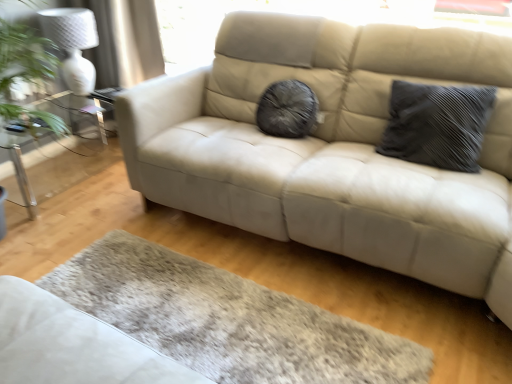
Question: Is dark gray textured pillow at right wider or thinner than clear glass table at left?

Choices:
 (A) wide
 (B) thin

Answer: (B)

Question: From a real-world perspective, relative to clear glass table at left, is dark gray textured pillow at right vertically above or below?

Choices:
 (A) above
 (B) below

Answer: (A)

Question: Which object is the closest to the clear glass table at left?

Choices:
 (A) white textured lamp at upper left
 (B) dark gray textured pillow at right

Answer: (A)

Question: Estimate the real-world distances between objects in this image. Which object is farther from the dark gray textured pillow at right?

Choices:
 (A) clear glass table at left
 (B) white textured lamp at upper left

Answer: (A)